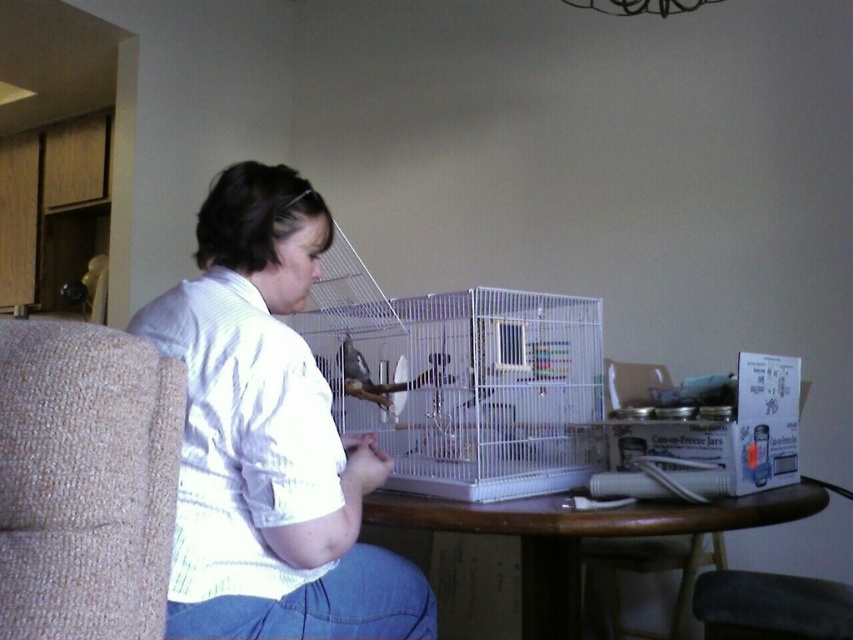
You are a person who wants to sit down at the wooden table at center while tending to the small animal in the cage. Is the clear plastic chair at lower right a suitable seat for you to comfortably reach the table?

The wooden table at center is not as tall as the clear plastic chair at lower right, meaning the chair is taller than the table. This would make it difficult to comfortably reach the table while sitting on the chair, so it might not be the best choice for sitting while tending to the animal.

You are a delivery person who needs to place a package that is 1.5 meters long on the table. The table has the white wire bird cage at center and other items. Can you fit the package on the table without moving any existing items?

The distance between the white wire bird cage at center and the other items on the table is 1.35 meters. Since the package is 1.5 meters long, which is longer than the available space between them, it won